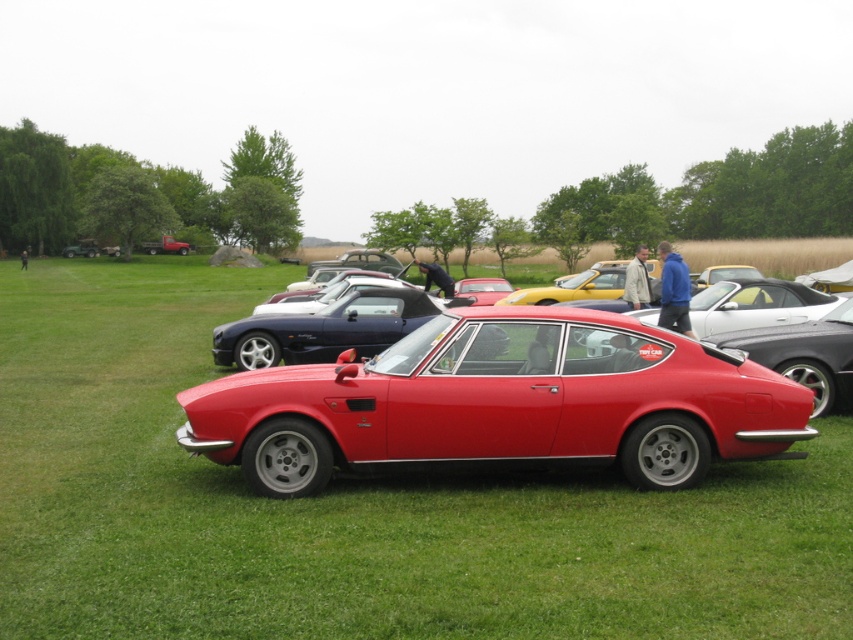
Question: Estimate the real-world distances between objects in this image. Which object is closer to the yellow matte car at center?

Choices:
 (A) glossy red car at center
 (B) green grass at center
 (C) matte red sports car at center

Answer: (A)

Question: Does matte red sports car at center have a larger size compared to yellow matte car at center?

Choices:
 (A) yes
 (B) no

Answer: (B)

Question: In this image, where is matte red sports car at center located relative to glossy red car at center?

Choices:
 (A) right
 (B) left

Answer: (B)

Question: Considering the real-world distances, which object is farthest from the yellow matte car at center?

Choices:
 (A) glossy red car at center
 (B) green grass at center

Answer: (B)

Question: Is matte red sports car at center bigger than glossy red car at center?

Choices:
 (A) no
 (B) yes

Answer: (A)

Question: Considering the real-world distances, which object is closest to the glossy red car at center?

Choices:
 (A) green grass at center
 (B) yellow matte car at center
 (C) matte red sports car at center

Answer: (B)